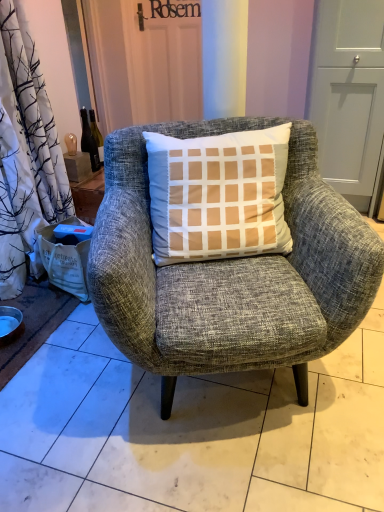
Find the location of a particular element. translucent glass bottle at upper left is located at coordinates [x=89, y=141].

Find the location of a particular element. The height and width of the screenshot is (512, 384). matte gray screen door at upper right is located at coordinates (348, 94).

What do you see at coordinates (230, 272) in the screenshot?
I see `textured gray armchair at center` at bounding box center [230, 272].

Image resolution: width=384 pixels, height=512 pixels. I want to click on matte silver bowl at lower left, so click(x=10, y=324).

The height and width of the screenshot is (512, 384). I want to click on translucent glass bottle at upper left, so click(x=89, y=141).

From the image's perspective, is white paper bag at lower left on textured gray armchair at center?

Actually, white paper bag at lower left appears below textured gray armchair at center in the image.

Is white paper bag at lower left next to textured gray armchair at center and touching it?

white paper bag at lower left and textured gray armchair at center are not in contact.

Is white paper bag at lower left thinner than textured gray armchair at center?

Yes.

Can you confirm if white paper bag at lower left is smaller than textured gray armchair at center?

Correct, white paper bag at lower left occupies less space than textured gray armchair at center.

Is textured gray armchair at center inside the boundaries of matte gray screen door at upper right, or outside?

textured gray armchair at center lies outside matte gray screen door at upper right.

This screenshot has height=512, width=384. What are the coordinates of `chair in front of the matte gray screen door at upper right` in the screenshot? It's located at (230, 272).

Which is more to the right, textured gray armchair at center or matte gray screen door at upper right?

Positioned to the right is matte gray screen door at upper right.

From the image's perspective, which one is positioned lower, textured gray armchair at center or matte silver bowl at lower left?

matte silver bowl at lower left is shown below in the image.

Between textured gray armchair at center and matte silver bowl at lower left, which one appears on the left side from the viewer's perspective?

matte silver bowl at lower left.

Looking at this image, does matte gray screen door at upper right turn towards white paper bag at lower left?

No, matte gray screen door at upper right is not oriented towards white paper bag at lower left.

Looking at this image, can you confirm if matte gray screen door at upper right is taller than white paper bag at lower left?

Yes, matte gray screen door at upper right is taller than white paper bag at lower left.

Locate an element on the screen. The image size is (384, 512). box located in front of the matte gray screen door at upper right is located at coordinates (65, 263).

Which of these two, matte gray screen door at upper right or white paper bag at lower left, is thinner?

white paper bag at lower left.

Considering the relative positions of textured gray armchair at center and translucent glass bottle at upper left in the image provided, is textured gray armchair at center to the right of translucent glass bottle at upper left from the viewer's perspective?

Indeed, textured gray armchair at center is positioned on the right side of translucent glass bottle at upper left.

Considering the sizes of objects textured gray armchair at center and translucent glass bottle at upper left in the image provided, who is bigger, textured gray armchair at center or translucent glass bottle at upper left?

Bigger between the two is textured gray armchair at center.

Considering the positions of points (290, 147) and (84, 143), is point (290, 147) farther from camera compared to point (84, 143)?

No, (290, 147) is in front of (84, 143).

Is textured gray armchair at center situated inside translucent glass bottle at upper left or outside?

textured gray armchair at center is located beyond the bounds of translucent glass bottle at upper left.

Which is more to the left, translucent glass bottle at upper left or matte silver bowl at lower left?

Positioned to the left is matte silver bowl at lower left.

From their relative heights in the image, would you say translucent glass bottle at upper left is taller or shorter than matte silver bowl at lower left?

In the image, translucent glass bottle at upper left appears to be taller than matte silver bowl at lower left.

Consider the image. Between translucent glass bottle at upper left and matte silver bowl at lower left, which one has smaller width?

With smaller width is translucent glass bottle at upper left.

Locate an element on the screen. bottle that appears behind the matte silver bowl at lower left is located at coordinates (89, 141).

Considering the sizes of objects white paper bag at lower left and translucent glass bottle at upper left in the image provided, who is smaller, white paper bag at lower left or translucent glass bottle at upper left?

translucent glass bottle at upper left is smaller.

Is white paper bag at lower left facing towards translucent glass bottle at upper left?

No, white paper bag at lower left does not turn towards translucent glass bottle at upper left.

What's the angular difference between white paper bag at lower left and translucent glass bottle at upper left's facing directions?

The angle between the facing direction of white paper bag at lower left and the facing direction of translucent glass bottle at upper left is 9.23 degrees.

From a real-world perspective, is white paper bag at lower left positioned under translucent glass bottle at upper left based on gravity?

Yes, from a real-world perspective, white paper bag at lower left is below translucent glass bottle at upper left.

Where is `chair above the white paper bag at lower left (from a real-world perspective)`? The image size is (384, 512). chair above the white paper bag at lower left (from a real-world perspective) is located at coordinates (230, 272).

The width and height of the screenshot is (384, 512). Identify the location of chair in front of the matte gray screen door at upper right. tap(230, 272).

From the image, which object appears to be nearer to white paper bag at lower left, textured gray armchair at center or translucent glass bottle at upper left?

Among the two, translucent glass bottle at upper left is located nearer to white paper bag at lower left.

From the image, which object appears to be farther from matte gray screen door at upper right, translucent glass bottle at upper left or textured gray armchair at center?

The object further to matte gray screen door at upper right is translucent glass bottle at upper left.

When comparing their distances from translucent glass bottle at upper left, does matte silver bowl at lower left or white paper bag at lower left seem further?

matte silver bowl at lower left.

Which object lies nearer to the anchor point translucent glass bottle at upper left, matte silver bowl at lower left or textured gray armchair at center?

matte silver bowl at lower left is closer to translucent glass bottle at upper left.

From the picture: Considering their positions, is translucent glass bottle at upper left positioned closer to matte silver bowl at lower left than matte gray screen door at upper right?

The object closer to matte silver bowl at lower left is translucent glass bottle at upper left.

Estimate the real-world distances between objects in this image. Which object is closer to translucent glass bottle at upper left, matte silver bowl at lower left or matte gray screen door at upper right?

matte silver bowl at lower left lies closer to translucent glass bottle at upper left than the other object.

Estimate the real-world distances between objects in this image. Which object is further from textured gray armchair at center, matte gray screen door at upper right or white paper bag at lower left?

matte gray screen door at upper right lies further to textured gray armchair at center than the other object.

Considering their positions, is textured gray armchair at center positioned closer to translucent glass bottle at upper left than white paper bag at lower left?

white paper bag at lower left is positioned closer to the anchor translucent glass bottle at upper left.

The height and width of the screenshot is (512, 384). What are the coordinates of `bottle between white paper bag at lower left and matte gray screen door at upper right from left to right` in the screenshot? It's located at (89, 141).

What are the coordinates of `chair situated between translucent glass bottle at upper left and matte gray screen door at upper right from left to right` in the screenshot? It's located at (230, 272).

Image resolution: width=384 pixels, height=512 pixels. I want to click on bottle between matte silver bowl at lower left and matte gray screen door at upper right, so click(x=89, y=141).

Where is `chair between white paper bag at lower left and matte gray screen door at upper right`? chair between white paper bag at lower left and matte gray screen door at upper right is located at coordinates (230, 272).